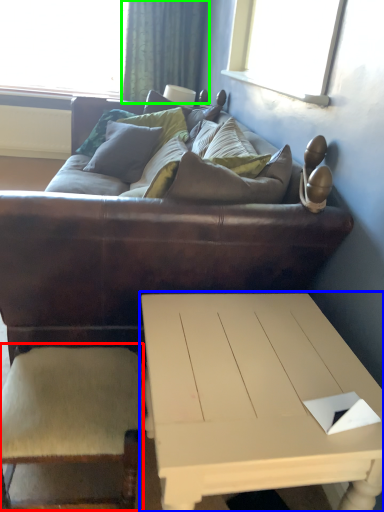
Question: Which is nearer to the armchair (highlighted by a red box)? coffee table (highlighted by a blue box) or curtain (highlighted by a green box).

Choices:
 (A) coffee table
 (B) curtain

Answer: (A)